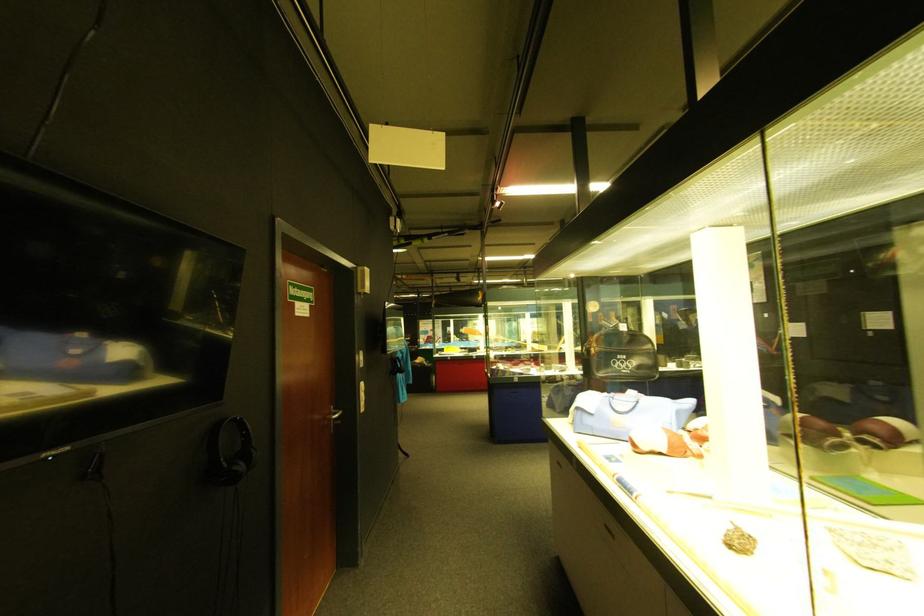
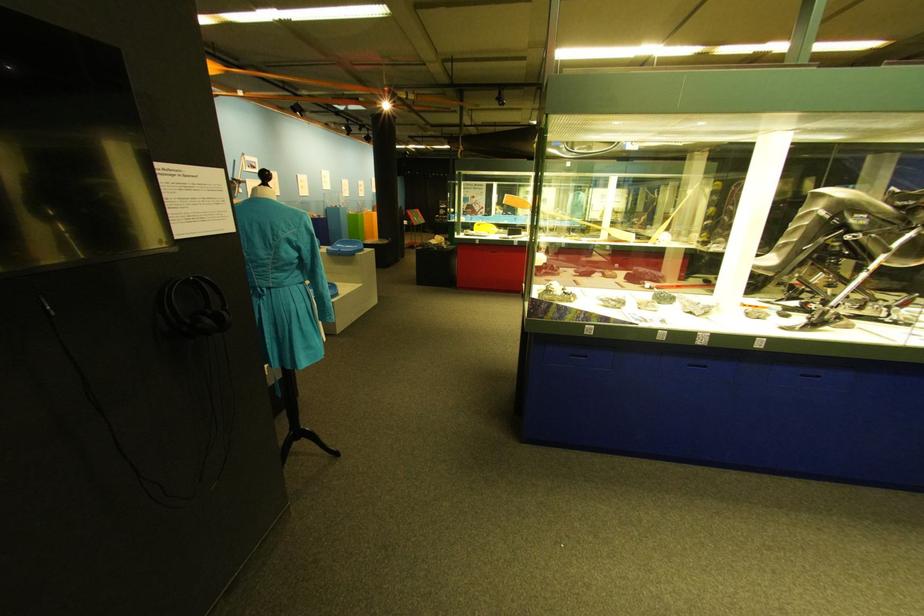
Question: What movement of the cameraman would produce the second image?

Choices:
 (A) Left
 (B) Right
 (C) Forward
 (D) Backward

Answer: (C)